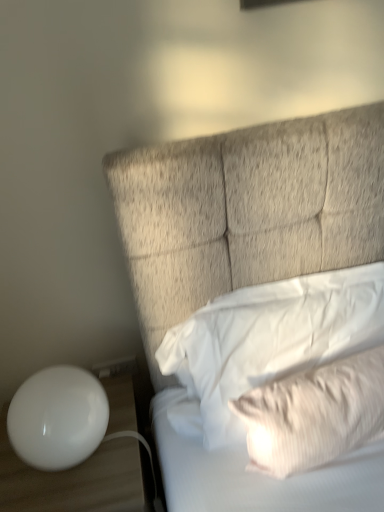
The height and width of the screenshot is (512, 384). I want to click on vacant point above white glossy table at lower left (from a real-world perspective), so click(x=62, y=472).